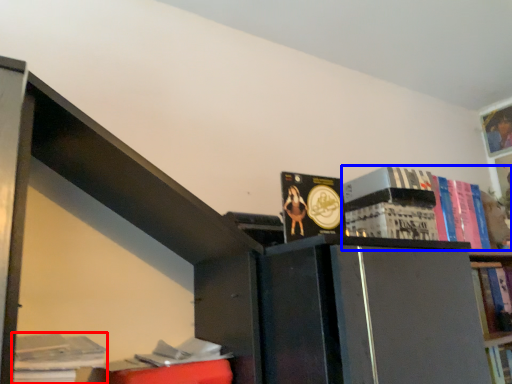
Question: Which point is further to the camera, book (highlighted by a red box) or book (highlighted by a blue box)?

Choices:
 (A) book
 (B) book

Answer: (B)